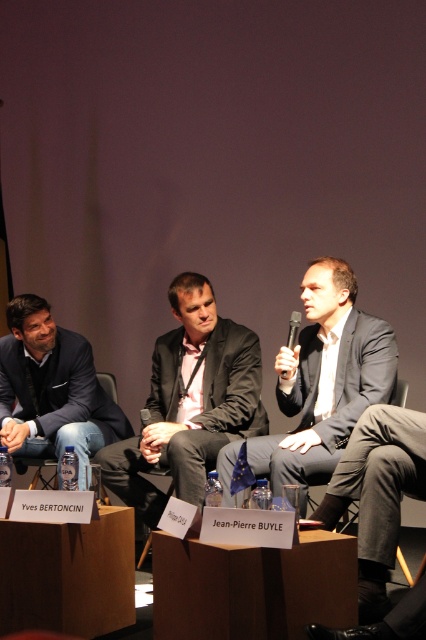
Question: Which point is closer to the camera?

Choices:
 (A) dark gray suit at center
 (B) dark blue denim jeans at left

Answer: (A)

Question: Does dark blue denim jeans at left appear on the left side of matte black suit at center?

Choices:
 (A) yes
 (B) no

Answer: (A)

Question: Which object appears farthest from the camera in this image?

Choices:
 (A) dark gray suit at center
 (B) matte black suit at center
 (C) black plastic microphone at center

Answer: (C)

Question: Can you confirm if dark gray suit at center is thinner than black plastic microphone at center?

Choices:
 (A) yes
 (B) no

Answer: (B)

Question: Which of the following is the farthest from the observer?

Choices:
 (A) dark blue denim jeans at left
 (B) matte black suit at center
 (C) dark gray suit at center

Answer: (A)

Question: Is dark blue denim jeans at left to the left of matte black suit at center from the viewer's perspective?

Choices:
 (A) yes
 (B) no

Answer: (A)